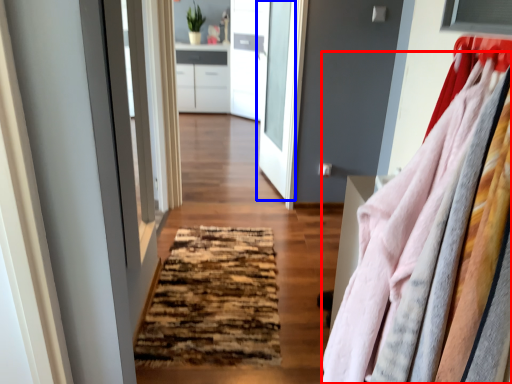
Question: Which object is further to the camera taking this photo, clothing (highlighted by a red box) or door (highlighted by a blue box)?

Choices:
 (A) clothing
 (B) door

Answer: (B)